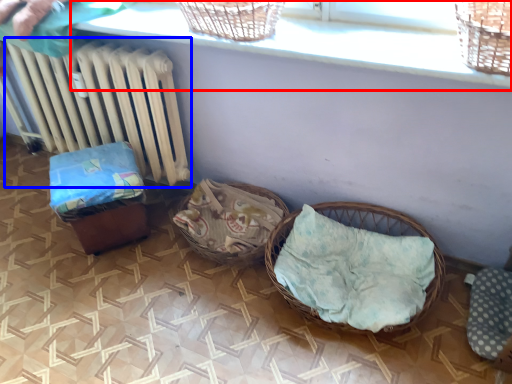
Question: Which object appears farthest to the camera in this image, window sill (highlighted by a red box) or radiator (highlighted by a blue box)?

Choices:
 (A) window sill
 (B) radiator

Answer: (B)